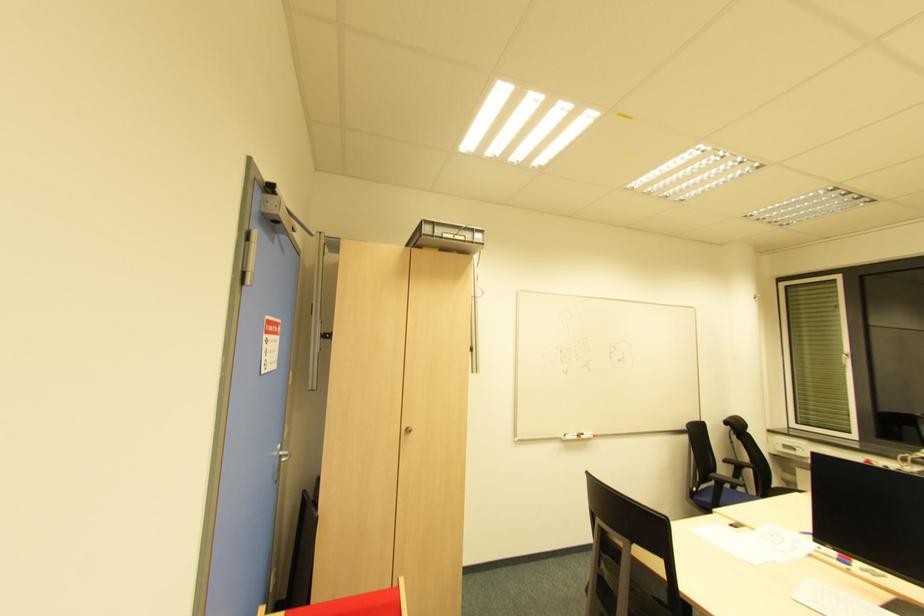
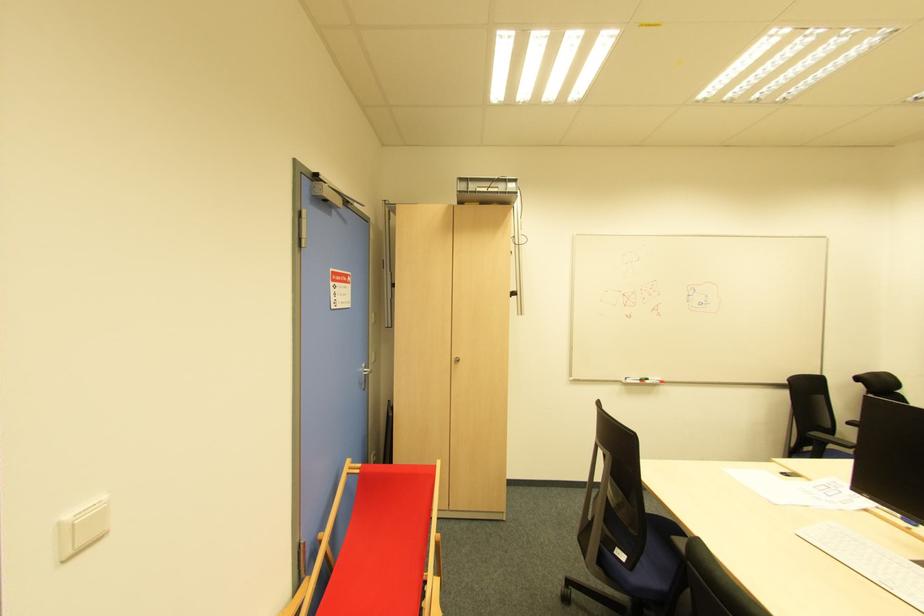
The point at (582, 438) is marked in the first image. Where is the corresponding point in the second image?

(647, 383)